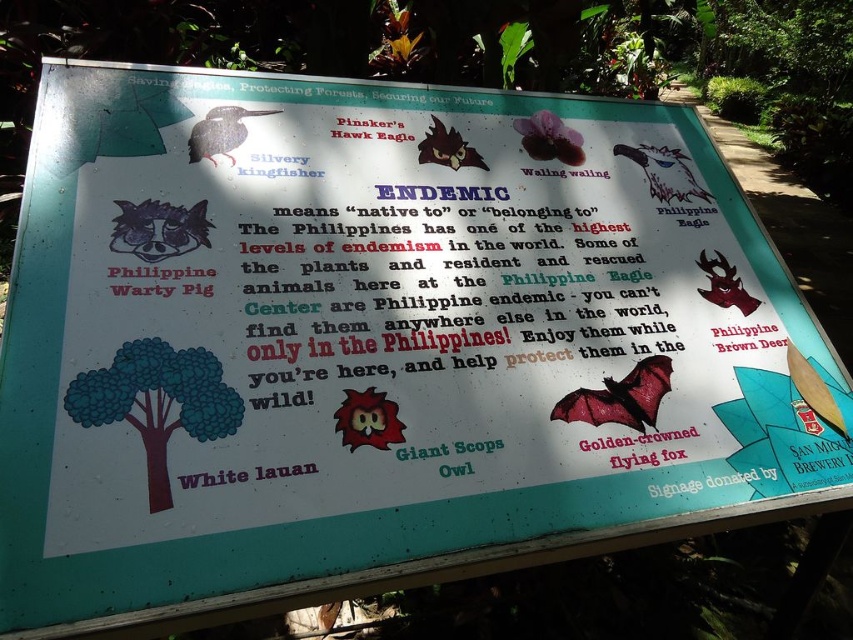
Question: Considering the real-world distances, which object is farthest from the matte black owl at upper center?

Choices:
 (A) purple matte flower at upper center
 (B) shiny red bat at center

Answer: (B)

Question: Among these objects, which one is nearest to the camera?

Choices:
 (A) matte gray bird at upper left
 (B) purple matte flower at upper center
 (C) white glossy philippine eagle at upper right

Answer: (A)

Question: Observing the image, what is the correct spatial positioning of green matte tree at lower left in reference to shiny red bat at center?

Choices:
 (A) below
 (B) above

Answer: (B)

Question: Considering the real-world distances, which object is closest to the white glossy philippine eagle at upper right?

Choices:
 (A) purple matte philippine warty pig at upper left
 (B) shiny red bat at center

Answer: (B)

Question: Does shiny red bat at center have a larger size compared to white glossy philippine eagle at upper right?

Choices:
 (A) no
 (B) yes

Answer: (B)

Question: Can you confirm if purple matte flower at upper center is positioned below matte black owl at upper center?

Choices:
 (A) no
 (B) yes

Answer: (A)